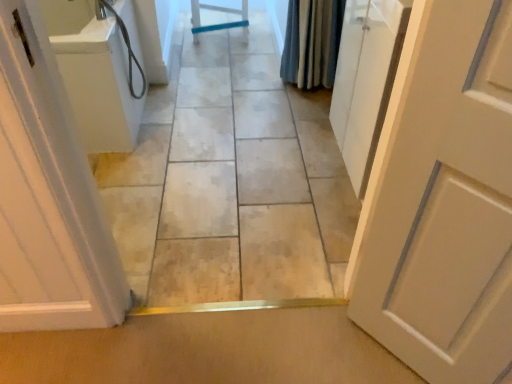
Where is `white glossy door at left, which ranks as the first door in left-to-right order`? white glossy door at left, which ranks as the first door in left-to-right order is located at coordinates (48, 195).

Measure the distance between white glossy door at left, which is counted as the second door, starting from the right, and camera.

white glossy door at left, which is counted as the second door, starting from the right, and camera are 29.48 inches apart from each other.

Locate an element on the screen. The image size is (512, 384). white matte door at right, the first door viewed from the right is located at coordinates (444, 201).

Describe the element at coordinates (312, 42) in the screenshot. I see `blue textured fabric shower curtain at upper right` at that location.

You are a GUI agent. You are given a task and a screenshot of the screen. Output one action in this format:
    pyautogui.click(x=<x>, y=<y>)
    Task: Click on the white glossy door at left, which ranks as the first door in left-to-right order
    The height and width of the screenshot is (384, 512).
    Given the screenshot: What is the action you would take?
    pyautogui.click(x=48, y=195)

Considering the sizes of objects white glossy door at left, which ranks as the first door in left-to-right order, and white matte door at right, arranged as the 2th door when viewed from the left, in the image provided, who is smaller, white glossy door at left, which ranks as the first door in left-to-right order, or white matte door at right, arranged as the 2th door when viewed from the left,?

white matte door at right, arranged as the 2th door when viewed from the left, is smaller.

Considering their positions, is white glossy door at left, which ranks as the first door in left-to-right order, located in front of or behind white matte door at right, the first door viewed from the right?

white glossy door at left, which ranks as the first door in left-to-right order, is positioned farther from the viewer than white matte door at right, the first door viewed from the right.

Measure the distance from white glossy door at left, which ranks as the first door in left-to-right order, to white matte door at right, arranged as the 2th door when viewed from the left.

white glossy door at left, which ranks as the first door in left-to-right order, is 85.38 centimeters away from white matte door at right, arranged as the 2th door when viewed from the left.

Looking at their sizes, would you say white glossy door at left, which is counted as the second door, starting from the right, is wider or thinner than white matte door at right, the first door viewed from the right?

In the image, white glossy door at left, which is counted as the second door, starting from the right, appears to be wider than white matte door at right, the first door viewed from the right.

Is white matte door at right, arranged as the 2th door when viewed from the left, bigger than white glossy door at left, which is counted as the second door, starting from the right?

Incorrect, white matte door at right, arranged as the 2th door when viewed from the left, is not larger than white glossy door at left, which is counted as the second door, starting from the right.

Would you consider white matte door at right, the first door viewed from the right, to be distant from white glossy door at left, which is counted as the second door, starting from the right?

That's not correct — white matte door at right, the first door viewed from the right, is a little close to white glossy door at left, which is counted as the second door, starting from the right.

Considering the relative sizes of white matte door at right, arranged as the 2th door when viewed from the left, and white glossy door at left, which is counted as the second door, starting from the right, in the image provided, is white matte door at right, arranged as the 2th door when viewed from the left, thinner than white glossy door at left, which is counted as the second door, starting from the right,?

Yes.

Would you say white glossy door at left, which is counted as the second door, starting from the right, is part of white matte door at right, the first door viewed from the right,'s contents?

That's incorrect, white glossy door at left, which is counted as the second door, starting from the right, is not inside white matte door at right, the first door viewed from the right.

From the image's perspective, is white matte door at right, the first door viewed from the right, beneath blue textured fabric shower curtain at upper right?

Yes.

Could blue textured fabric shower curtain at upper right be considered to be inside white matte door at right, arranged as the 2th door when viewed from the left?

No, blue textured fabric shower curtain at upper right is not inside white matte door at right, arranged as the 2th door when viewed from the left.

Is white matte door at right, the first door viewed from the right, in contact with blue textured fabric shower curtain at upper right?

No, white matte door at right, the first door viewed from the right, is not with blue textured fabric shower curtain at upper right.

Is white matte door at right, the first door viewed from the right, wider than blue textured fabric shower curtain at upper right?

No, white matte door at right, the first door viewed from the right, is not wider than blue textured fabric shower curtain at upper right.

In terms of size, does blue textured fabric shower curtain at upper right appear bigger or smaller than white matte door at right, the first door viewed from the right?

Clearly, blue textured fabric shower curtain at upper right is smaller in size than white matte door at right, the first door viewed from the right.

Which is nearer, (325, 40) or (399, 90)?

Point (325, 40) appears to be farther away from the viewer than point (399, 90).

In the scene shown: Is blue textured fabric shower curtain at upper right aimed at white matte door at right, the first door viewed from the right?

Yes, blue textured fabric shower curtain at upper right is oriented towards white matte door at right, the first door viewed from the right.

Between blue textured fabric shower curtain at upper right and white matte door at right, the first door viewed from the right, which one has less height?

Standing shorter between the two is blue textured fabric shower curtain at upper right.

Can you tell me how much white glossy door at left, which ranks as the first door in left-to-right order, and smooth tile floor at center differ in facing direction?

178 degrees.

Find the location of a particular element. Image resolution: width=512 pixels, height=384 pixels. path located underneath the white glossy door at left, which is counted as the second door, starting from the right (from a real-world perspective) is located at coordinates (231, 183).

Who is taller, white glossy door at left, which is counted as the second door, starting from the right, or smooth tile floor at center?

With more height is white glossy door at left, which is counted as the second door, starting from the right.

Is white glossy door at left, which ranks as the first door in left-to-right order, looking in the opposite direction of smooth tile floor at center?

No, white glossy door at left, which ranks as the first door in left-to-right order, is not facing away from smooth tile floor at center.

Locate an element on the screen. shower curtain that appears above the smooth tile floor at center (from the image's perspective) is located at coordinates (312, 42).

Is smooth tile floor at center taller than blue textured fabric shower curtain at upper right?

No, smooth tile floor at center is not taller than blue textured fabric shower curtain at upper right.

Is smooth tile floor at center spatially inside blue textured fabric shower curtain at upper right, or outside of it?

smooth tile floor at center is not inside blue textured fabric shower curtain at upper right, it's outside.

From a real-world perspective, which is physically above, smooth tile floor at center or blue textured fabric shower curtain at upper right?

In real-world perspective, blue textured fabric shower curtain at upper right is above.

Looking at this image, which is behind, white glossy door at left, which is counted as the second door, starting from the right, or blue textured fabric shower curtain at upper right?

Positioned behind is blue textured fabric shower curtain at upper right.

Considering the relative positions of white glossy door at left, which is counted as the second door, starting from the right, and blue textured fabric shower curtain at upper right in the image provided, is white glossy door at left, which is counted as the second door, starting from the right, to the left of blue textured fabric shower curtain at upper right from the viewer's perspective?

Indeed, white glossy door at left, which is counted as the second door, starting from the right, is positioned on the left side of blue textured fabric shower curtain at upper right.

Looking at this image, from a real-world perspective, who is located higher, white glossy door at left, which is counted as the second door, starting from the right, or blue textured fabric shower curtain at upper right?

In real-world perspective, white glossy door at left, which is counted as the second door, starting from the right, is above.

Image resolution: width=512 pixels, height=384 pixels. In order to click on door below the white glossy door at left, which ranks as the first door in left-to-right order (from the image's perspective) in this screenshot , I will do `click(444, 201)`.

The image size is (512, 384). Identify the location of door behind the white matte door at right, the first door viewed from the right. (48, 195).

Considering their positions, is blue textured fabric shower curtain at upper right positioned further to white glossy door at left, which ranks as the first door in left-to-right order, than smooth tile floor at center?

The object further to white glossy door at left, which ranks as the first door in left-to-right order, is blue textured fabric shower curtain at upper right.

When comparing their distances from white matte door at right, arranged as the 2th door when viewed from the left, does smooth tile floor at center or blue textured fabric shower curtain at upper right seem closer?

smooth tile floor at center is positioned closer to the anchor white matte door at right, arranged as the 2th door when viewed from the left.

Considering their positions, is smooth tile floor at center positioned closer to white glossy door at left, which is counted as the second door, starting from the right, than white matte door at right, arranged as the 2th door when viewed from the left?

smooth tile floor at center is positioned closer to the anchor white glossy door at left, which is counted as the second door, starting from the right.

Considering their positions, is blue textured fabric shower curtain at upper right positioned closer to white matte door at right, the first door viewed from the right, than smooth tile floor at center?

smooth tile floor at center is closer to white matte door at right, the first door viewed from the right.

When comparing their distances from blue textured fabric shower curtain at upper right, does white matte door at right, the first door viewed from the right, or white glossy door at left, which is counted as the second door, starting from the right, seem closer?

white matte door at right, the first door viewed from the right.

From the image, which object appears to be farther from blue textured fabric shower curtain at upper right, white matte door at right, arranged as the 2th door when viewed from the left, or smooth tile floor at center?

The object further to blue textured fabric shower curtain at upper right is white matte door at right, arranged as the 2th door when viewed from the left.

Based on their spatial positions, is white matte door at right, the first door viewed from the right, or blue textured fabric shower curtain at upper right closer to white glossy door at left, which ranks as the first door in left-to-right order?

The object closer to white glossy door at left, which ranks as the first door in left-to-right order, is white matte door at right, the first door viewed from the right.

Estimate the real-world distances between objects in this image. Which object is closer to smooth tile floor at center, white matte door at right, the first door viewed from the right, or blue textured fabric shower curtain at upper right?

The object closer to smooth tile floor at center is blue textured fabric shower curtain at upper right.

This screenshot has height=384, width=512. I want to click on door located between white matte door at right, arranged as the 2th door when viewed from the left, and blue textured fabric shower curtain at upper right in the depth direction, so click(48, 195).

Where is `path between white glossy door at left, which is counted as the second door, starting from the right, and blue textured fabric shower curtain at upper right from front to back`? path between white glossy door at left, which is counted as the second door, starting from the right, and blue textured fabric shower curtain at upper right from front to back is located at coordinates (231, 183).

Identify the location of path between white glossy door at left, which ranks as the first door in left-to-right order, and white matte door at right, arranged as the 2th door when viewed from the left. The height and width of the screenshot is (384, 512). (231, 183).

Where is `path between white matte door at right, the first door viewed from the right, and blue textured fabric shower curtain at upper right, along the z-axis`? The image size is (512, 384). path between white matte door at right, the first door viewed from the right, and blue textured fabric shower curtain at upper right, along the z-axis is located at coordinates (231, 183).